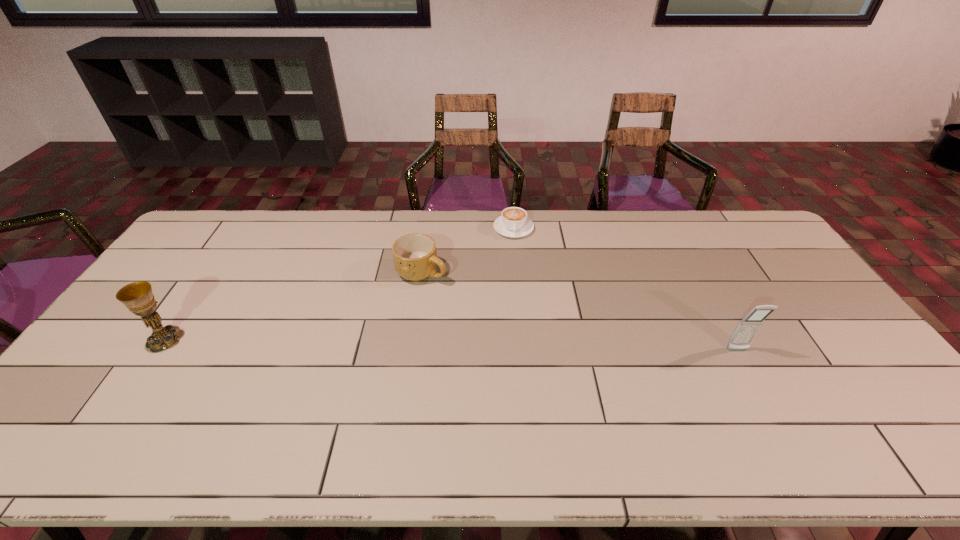
Identify the location of vacant space located 0.230m on the side with the handle of the second object from left to right. Image resolution: width=960 pixels, height=540 pixels. (492, 320).

Where is `vacant region located 0.370m on the side of the farthest object with the handle`? The image size is (960, 540). vacant region located 0.370m on the side of the farthest object with the handle is located at coordinates (518, 317).

Where is `vacant space located 0.210m on the side of the farthest object with the handle`? Image resolution: width=960 pixels, height=540 pixels. vacant space located 0.210m on the side of the farthest object with the handle is located at coordinates (516, 280).

At what (x,y) coordinates should I click in order to perform the action: click on free point located 0.200m on the side of the farthest object with the handle. Please return your answer as a coordinate pair (x, y). The height and width of the screenshot is (540, 960). Looking at the image, I should click on (516, 278).

The height and width of the screenshot is (540, 960). Find the location of `object situated at the far edge`. object situated at the far edge is located at coordinates (513, 222).

Where is `object present at the left edge`? Image resolution: width=960 pixels, height=540 pixels. object present at the left edge is located at coordinates (137, 296).

Find the location of a particular element. vacant space at the far edge of the desktop is located at coordinates (647, 232).

In the image, there is a desktop. What are the coordinates of `free space at the near edge` in the screenshot? It's located at click(717, 410).

Find the location of a particular element. Image resolution: width=960 pixels, height=540 pixels. free spot at the left edge of the desktop is located at coordinates (132, 373).

In the image, there is a desktop. What are the coordinates of `vacant area at the right edge` in the screenshot? It's located at (847, 381).